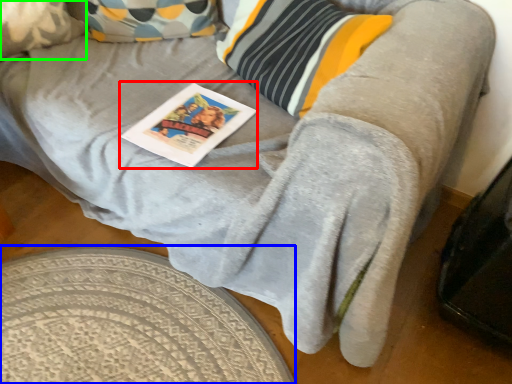
Question: Based on their relative distances, which object is nearer to magazine (highlighted by a red box)? Choose from round table (highlighted by a blue box) and pillow (highlighted by a green box).

Choices:
 (A) round table
 (B) pillow

Answer: (A)